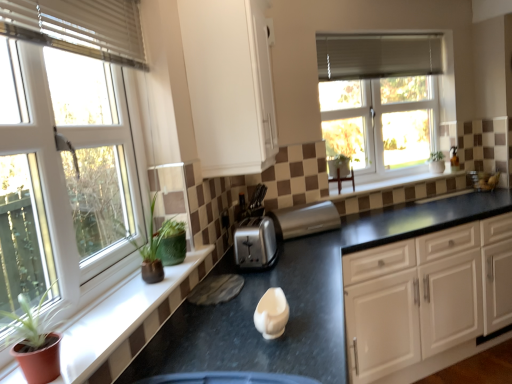
At what (x,y) coordinates should I click in order to perform the action: click on vacant area that lies between green matte plant at left and white plastic window at left, which appears as the first window when viewed from the front. Please return your answer as a coordinate pair (x, y). The height and width of the screenshot is (384, 512). Looking at the image, I should click on (98, 327).